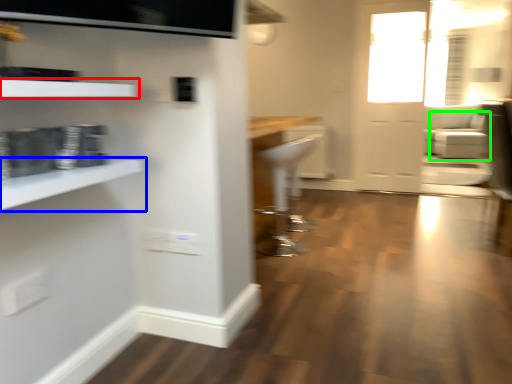
Question: Estimate the real-world distances between objects in this image. Which object is farther from shelf (highlighted by a red box), shelf (highlighted by a blue box) or armchair (highlighted by a green box)?

Choices:
 (A) shelf
 (B) armchair

Answer: (B)